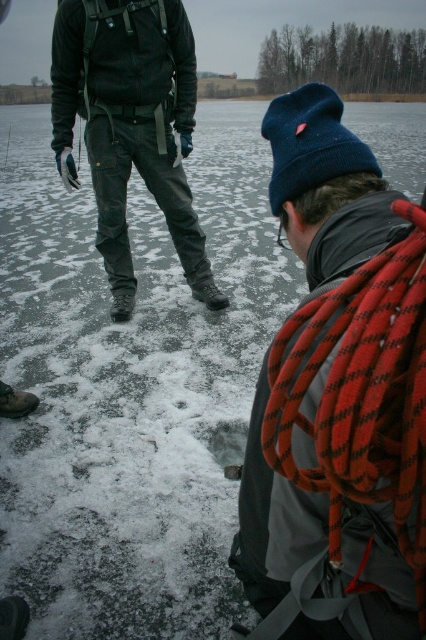
Question: Does red rope at center appear over dark green pants at center?

Choices:
 (A) no
 (B) yes

Answer: (A)

Question: Which object appears closest to the camera in this image?

Choices:
 (A) dark green pants at center
 (B) red rope at center

Answer: (B)

Question: Is red rope at center to the right of dark green pants at center from the viewer's perspective?

Choices:
 (A) yes
 (B) no

Answer: (A)

Question: Does red rope at center appear on the right side of dark green pants at center?

Choices:
 (A) no
 (B) yes

Answer: (B)

Question: Which point is farther from the camera taking this photo?

Choices:
 (A) (112, 196)
 (B) (298, 224)

Answer: (A)